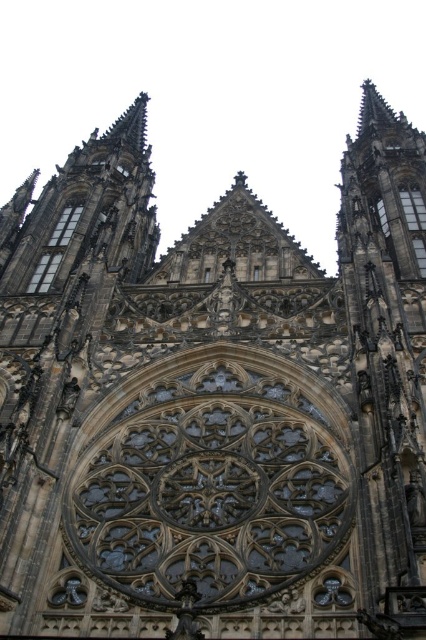
You are standing in front of the Gothic cathedral and notice two points marked on the facade. The first point is at coordinates point (72, 225) and the second is at point (422, 205). If you were to draw a straight line from your eye level to each point, which point would require the line to be angled downward more steeply?

Point (72, 225) is behind point (422, 205). Since point (72, 225) is lower on the facade, drawing a line to it would require a steeper downward angle compared to the line to point (422, 205), which is higher up.

You are a tourist standing in front of the cathedral and want to take a photo of the clear glass window at left and the transparent glass window at upper right. Which window should you look up to see?

You should look up to see the transparent glass window at upper right because the clear glass window at left is located below it.